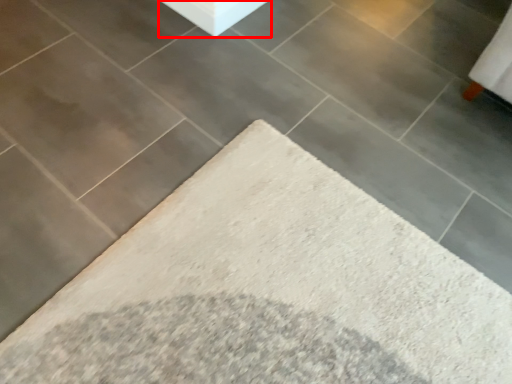
Question: From the image's perspective, considering the relative positions of concrete (annotated by the red box) and furniture in the image provided, where is concrete (annotated by the red box) located with respect to the staircase?

Choices:
 (A) above
 (B) below

Answer: (A)